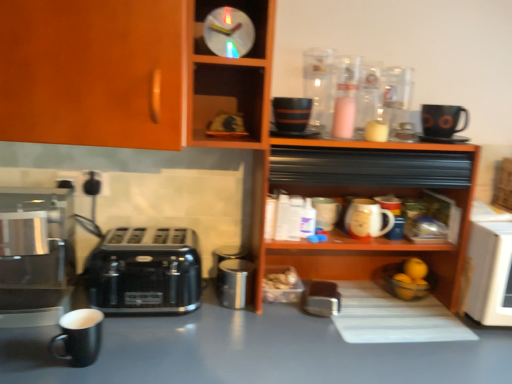
Question: Considering the relative positions of matte ceramic mug at shelf center and wooden shelf at upper center in the image provided, is matte ceramic mug at shelf center to the left of wooden shelf at upper center from the viewer's perspective?

Choices:
 (A) no
 (B) yes

Answer: (A)

Question: Is matte ceramic mug at shelf center further to camera compared to wooden shelf at upper center?

Choices:
 (A) yes
 (B) no

Answer: (A)

Question: Is matte ceramic mug at shelf center facing away from wooden shelf at upper center?

Choices:
 (A) no
 (B) yes

Answer: (B)

Question: Are matte ceramic mug at shelf center and wooden shelf at upper center far apart?

Choices:
 (A) yes
 (B) no

Answer: (B)

Question: From a real-world perspective, is matte ceramic mug at shelf center positioned under wooden shelf at upper center based on gravity?

Choices:
 (A) yes
 (B) no

Answer: (A)

Question: Looking at their shapes, would you say translucent plastic clock at upper center is wider or thinner than black plastic toaster at lower left?

Choices:
 (A) wide
 (B) thin

Answer: (B)

Question: Is translucent plastic clock at upper center in front of or behind black plastic toaster at lower left in the image?

Choices:
 (A) front
 (B) behind

Answer: (A)

Question: Is translucent plastic clock at upper center inside or outside of black plastic toaster at lower left?

Choices:
 (A) outside
 (B) inside

Answer: (A)

Question: In terms of size, does translucent plastic clock at upper center appear bigger or smaller than black plastic toaster at lower left?

Choices:
 (A) small
 (B) big

Answer: (A)

Question: Is black matte mug at lower left to the left or to the right of black matte table at lower left in the image?

Choices:
 (A) right
 (B) left

Answer: (B)

Question: Is black matte mug at lower left situated inside black matte table at lower left or outside?

Choices:
 (A) outside
 (B) inside

Answer: (A)

Question: Is black matte mug at lower left taller or shorter than black matte table at lower left?

Choices:
 (A) short
 (B) tall

Answer: (A)

Question: From the image's perspective, is black matte mug at lower left located above or below black matte table at lower left?

Choices:
 (A) below
 (B) above

Answer: (B)

Question: Choose the correct answer: Is matte ceramic mug at shelf center inside translucent plastic clock at upper center or outside it?

Choices:
 (A) outside
 (B) inside

Answer: (A)

Question: From a real-world perspective, is matte ceramic mug at shelf center above or below translucent plastic clock at upper center?

Choices:
 (A) below
 (B) above

Answer: (A)